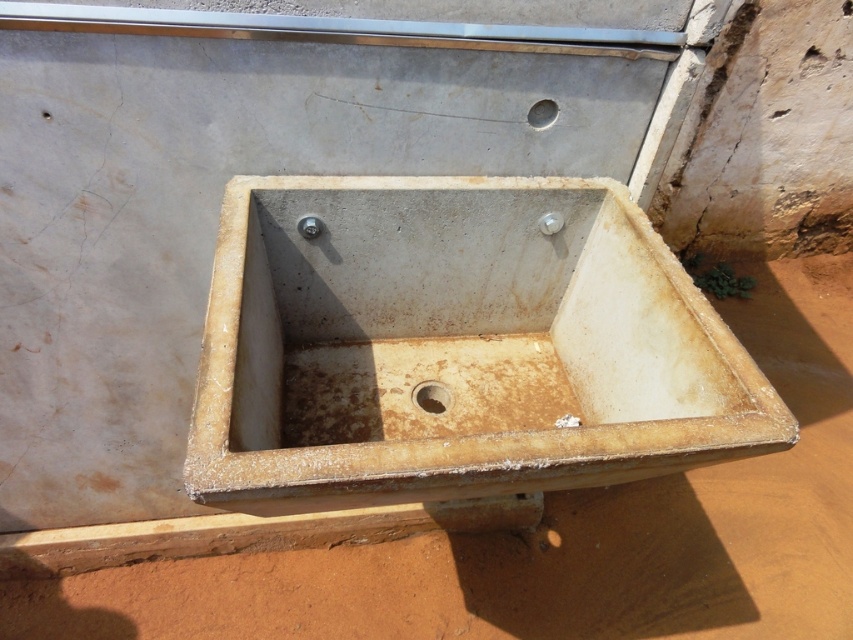
Does rusty concrete sink at center have a greater height compared to rusty metal drain at center?

Correct, rusty concrete sink at center is much taller as rusty metal drain at center.

Who is positioned more to the left, rusty concrete sink at center or rusty metal drain at center?

rusty metal drain at center

The width and height of the screenshot is (853, 640). In order to click on rusty concrete sink at center in this screenshot , I will do `click(456, 346)`.

This screenshot has height=640, width=853. In order to click on rusty concrete sink at center in this screenshot , I will do `click(456, 346)`.